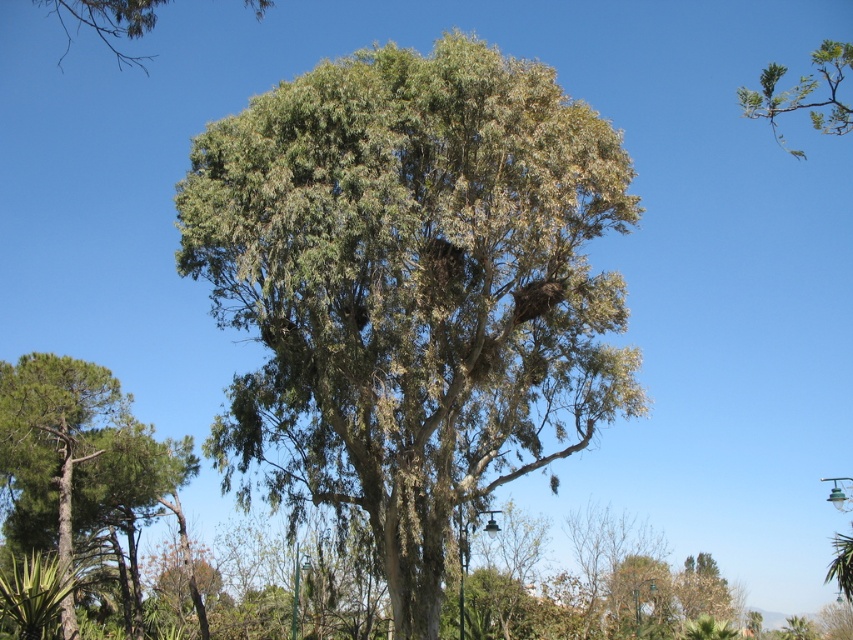
Does green leafy branch at upper right have a lesser width compared to green leafy tree at upper left?

Yes.

Is green leafy branch at upper right shorter than green leafy tree at upper left?

Correct, green leafy branch at upper right is not as tall as green leafy tree at upper left.

Is point (819, 128) positioned behind point (125, 52)?

No, (819, 128) is in front of (125, 52).

Where is `green leafy branch at upper right`? This screenshot has width=853, height=640. green leafy branch at upper right is located at coordinates (804, 93).

Between green leafy tree at center and green leafy branch at upper right, which one is positioned higher?

Positioned higher is green leafy branch at upper right.

From the picture: Between green leafy tree at center and green leafy branch at upper right, which one appears on the right side from the viewer's perspective?

green leafy branch at upper right

Is point (421, 109) positioned behind point (824, 76)?

No, it is not.

Image resolution: width=853 pixels, height=640 pixels. In order to click on green leafy tree at center in this screenshot , I will do `click(410, 288)`.

Is green leafy tree at center positioned at the back of green leafy tree at upper left?

Yes, green leafy tree at center is behind green leafy tree at upper left.

Find the location of a particular element. The width and height of the screenshot is (853, 640). green leafy tree at center is located at coordinates (410, 288).

Is point (403, 296) closer to viewer compared to point (126, 10)?

No, it is not.

The height and width of the screenshot is (640, 853). Find the location of `green leafy tree at center`. green leafy tree at center is located at coordinates (410, 288).